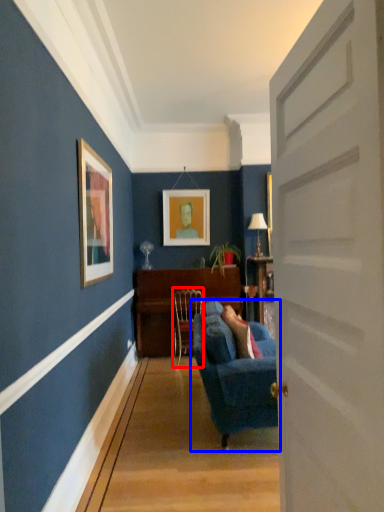
Question: Which point is closer to the camera, chair (highlighted by a red box) or studio couch (highlighted by a blue box)?

Choices:
 (A) chair
 (B) studio couch

Answer: (B)